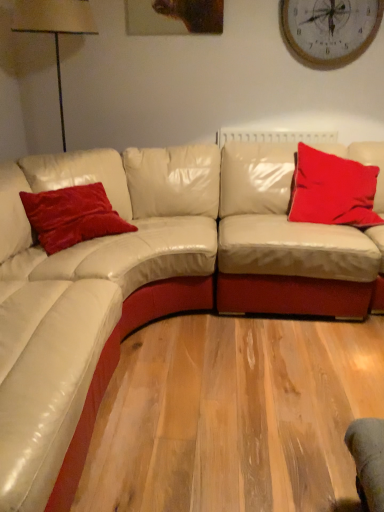
Question: From a real-world perspective, is beige fabric lampshade at left physically located above or below wooden clock at upper center?

Choices:
 (A) below
 (B) above

Answer: (A)

Question: From their relative heights in the image, would you say beige fabric lampshade at left is taller or shorter than wooden clock at upper center?

Choices:
 (A) tall
 (B) short

Answer: (A)

Question: Which of these objects is positioned farthest from the wooden clock at upper center?

Choices:
 (A) velvet red pillow at left, the 2th pillow when ordered from right to left
 (B) beige fabric lampshade at left
 (C) white leather couch at center
 (D) velvet red pillow at upper right, which is the second pillow in left-to-right order

Answer: (A)

Question: Which is nearer to the wooden clock at upper center?

Choices:
 (A) velvet red pillow at left, which is the 1th pillow from left to right
 (B) white leather couch at center
 (C) velvet red pillow at upper right, marked as the 1th pillow in a right-to-left arrangement
 (D) beige fabric lampshade at left

Answer: (C)